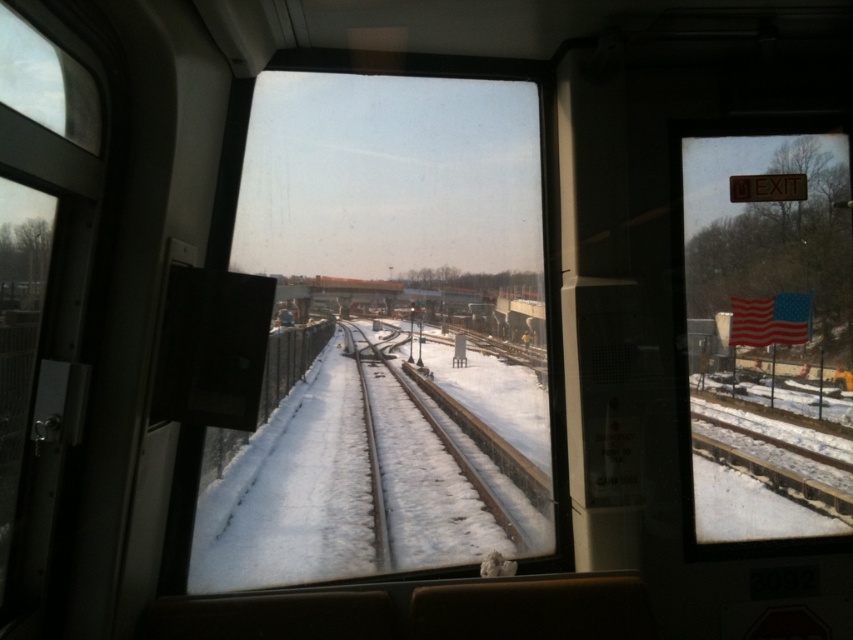
You are sitting in the train and looking through the window. You see two points marked on the window. The first point is at coordinate point (318, 544) and the second point is at coordinate point (737, 512). Which point is closer to your eyes?

Point (318, 544) is further to the camera than point (737, 512), so the point closer to your eyes is point (737, 512).